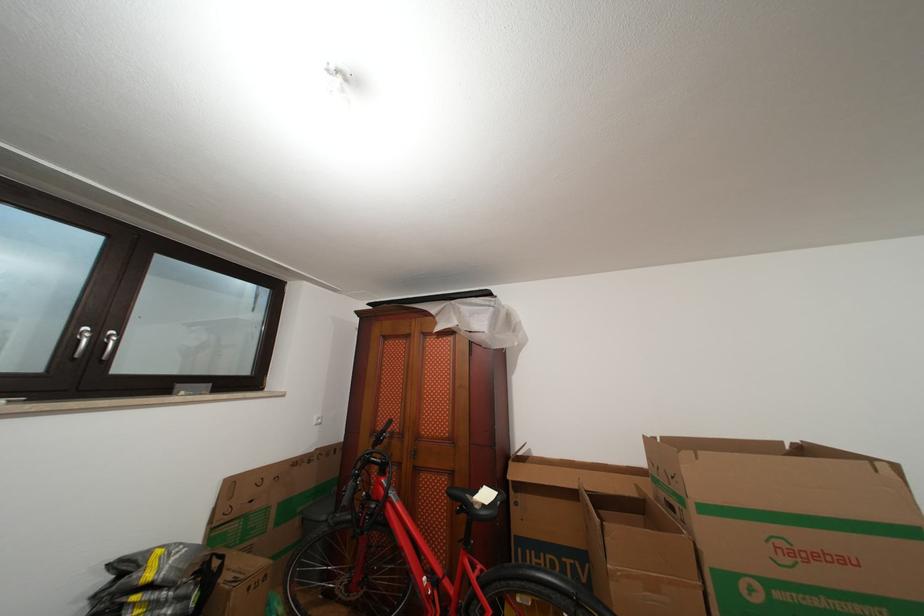
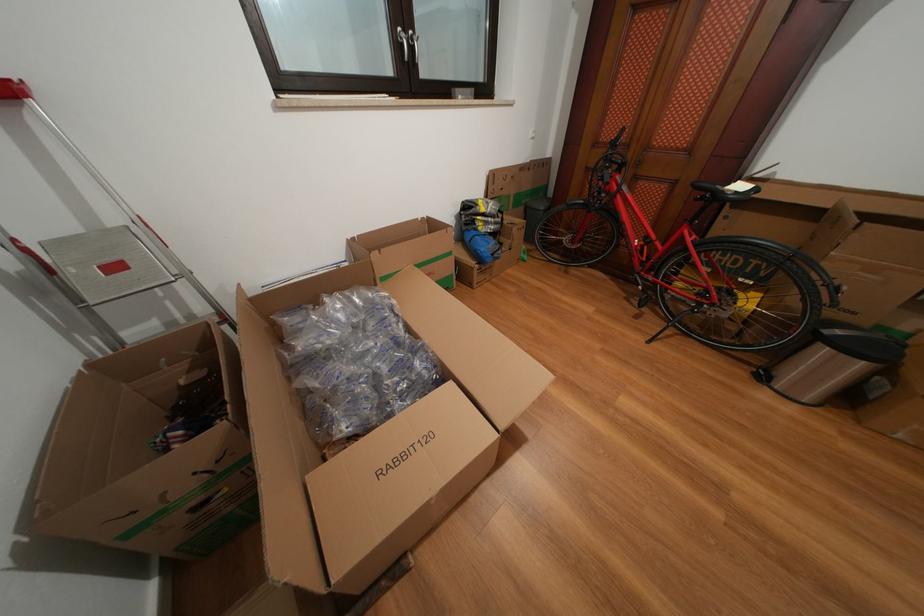
Find the pixel in the second image that matches (156,581) in the first image.

(491, 215)